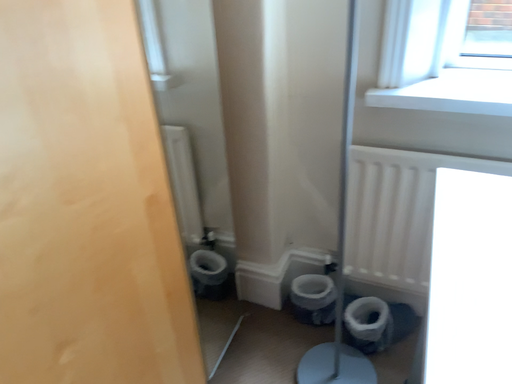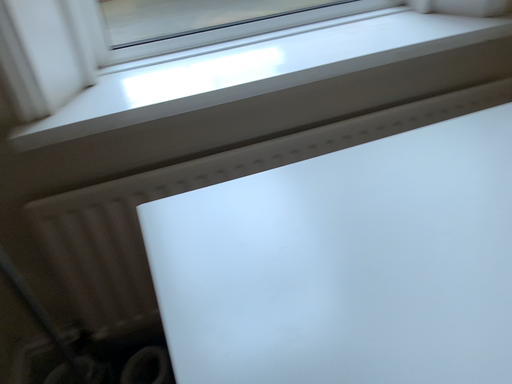
Question: How did the camera likely rotate when shooting the video?

Choices:
 (A) rotated right
 (B) rotated left

Answer: (A)